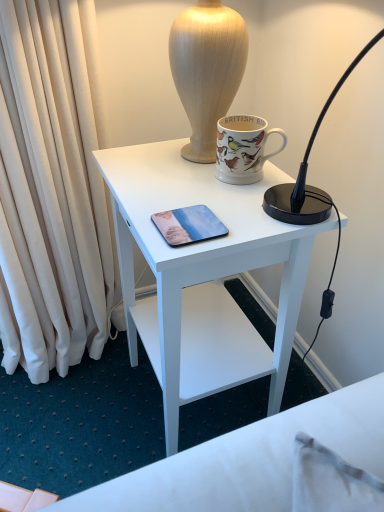
Question: In terms of width, does metallic glossy phone at center look wider or thinner when compared to matte ceramic mug at upper center?

Choices:
 (A) wide
 (B) thin

Answer: (A)

Question: Would you say metallic glossy phone at center is to the left or to the right of matte ceramic mug at upper center in the picture?

Choices:
 (A) left
 (B) right

Answer: (A)

Question: Based on their relative distances, which object is nearer to the matte ceramic mug at upper center?

Choices:
 (A) metallic glossy phone at center
 (B) white matte desk at center

Answer: (A)

Question: Considering the real-world distances, which object is closest to the white matte desk at center?

Choices:
 (A) matte ceramic mug at upper center
 (B) metallic glossy phone at center

Answer: (A)